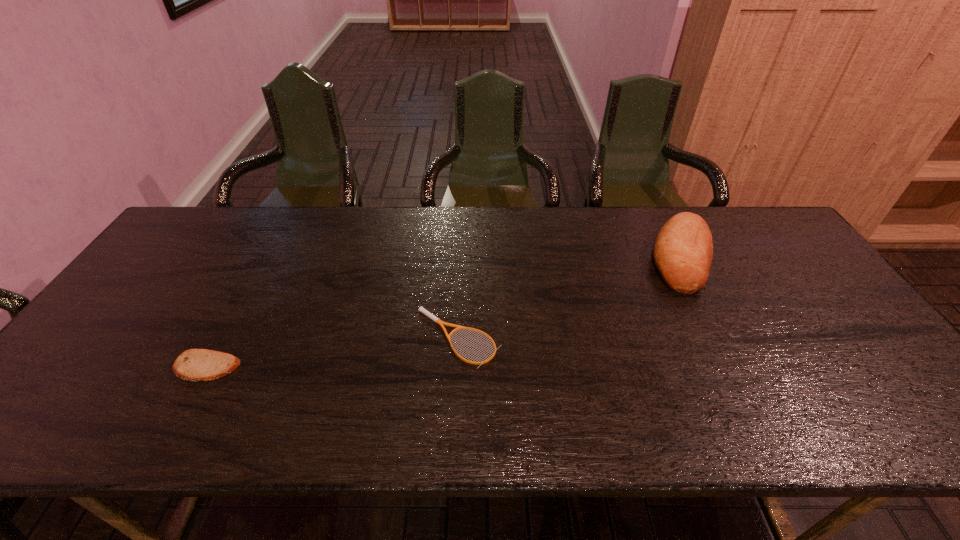
Where is `bread`? This screenshot has height=540, width=960. bread is located at coordinates (683, 252).

What are the coordinates of `the farthest object` in the screenshot? It's located at (683, 252).

Find the location of a particular element. The height and width of the screenshot is (540, 960). pita bread is located at coordinates (195, 365).

This screenshot has width=960, height=540. I want to click on the leftmost object, so click(x=195, y=365).

Find the location of a particular element. the second object from left to right is located at coordinates (421, 309).

What are the coordinates of `the shortest object` in the screenshot? It's located at (421, 309).

I want to click on vacant space situated 0.060m on the right of the rightmost object, so click(734, 258).

Where is `vacant space situated on the front of the second tallest object`? This screenshot has height=540, width=960. vacant space situated on the front of the second tallest object is located at coordinates (171, 431).

You are a GUI agent. You are given a task and a screenshot of the screen. Output one action in this format:
    pyautogui.click(x=<x>, y=<y>)
    Task: Click on the free spot located on the right of the tennis racket
    
    Given the screenshot: What is the action you would take?
    pyautogui.click(x=533, y=338)

Where is `object that is positioned at the far edge`? object that is positioned at the far edge is located at coordinates (683, 252).